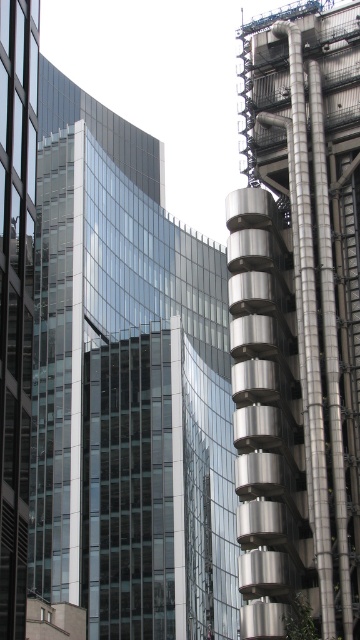
Between transparent glass building at center and polished silver tower at right, which one appears on the left side from the viewer's perspective?

From the viewer's perspective, transparent glass building at center appears more on the left side.

Is point (160, 596) positioned before point (243, 308)?

No, it is not.

Locate an element on the screen. This screenshot has height=640, width=360. transparent glass building at center is located at coordinates (127, 388).

Who is positioned more to the right, polished silver tower at right or transparent glass skyscraper at left?

Positioned to the right is polished silver tower at right.

Consider the image. Can you confirm if polished silver tower at right is positioned below transparent glass skyscraper at left?

Yes, polished silver tower at right is below transparent glass skyscraper at left.

The height and width of the screenshot is (640, 360). Find the location of `polished silver tower at right`. polished silver tower at right is located at coordinates (298, 321).

Does transparent glass building at center have a greater width compared to transparent glass skyscraper at left?

Indeed, transparent glass building at center has a greater width compared to transparent glass skyscraper at left.

Who is more forward, [78,448] or [18,243]?

Positioned in front is point [18,243].

I want to click on transparent glass building at center, so click(x=127, y=388).